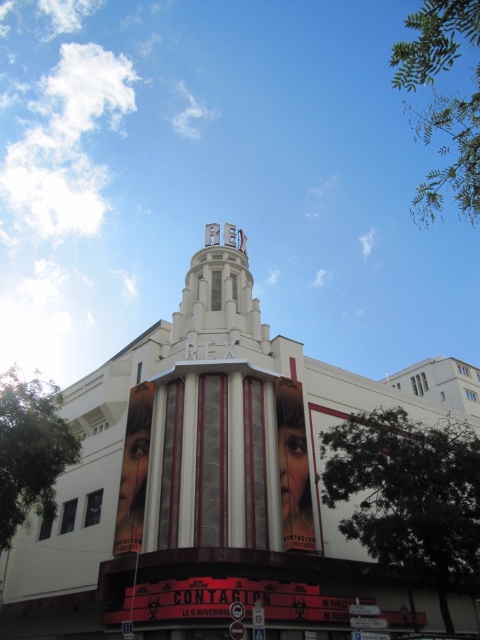
Question: Can you confirm if smooth glossy poster at center is thinner than matte metallic poster at center?

Choices:
 (A) no
 (B) yes

Answer: (A)

Question: Which of these objects is positioned closest to the matte metallic poster at center?

Choices:
 (A) white/smooth theater at center
 (B) smooth glossy poster at center

Answer: (B)

Question: Which object appears farthest from the camera in this image?

Choices:
 (A) matte metallic poster at center
 (B) smooth glossy poster at center
 (C) white/smooth theater at center

Answer: (B)

Question: Is white/smooth theater at center closer to the viewer compared to smooth glossy poster at center?

Choices:
 (A) yes
 (B) no

Answer: (A)

Question: Which point is farther to the camera?

Choices:
 (A) smooth glossy poster at center
 (B) white/smooth theater at center
 (C) matte metallic poster at center

Answer: (A)

Question: Can you confirm if smooth glossy poster at center is positioned below matte metallic poster at center?

Choices:
 (A) yes
 (B) no

Answer: (B)